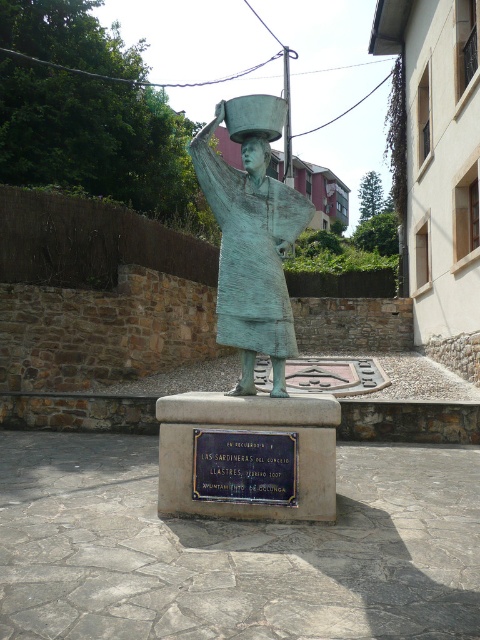
How distant is green patina statue at center from bronze plaque at center?

The distance of green patina statue at center from bronze plaque at center is 31.43 inches.

Measure the distance between green patina statue at center and bronze plaque at center.

green patina statue at center and bronze plaque at center are 79.82 centimeters apart from each other.

Where is `green patina statue at center`? The height and width of the screenshot is (640, 480). green patina statue at center is located at coordinates (252, 252).

Find the location of a particular element. This screenshot has height=640, width=480. green patina statue at center is located at coordinates (252, 252).